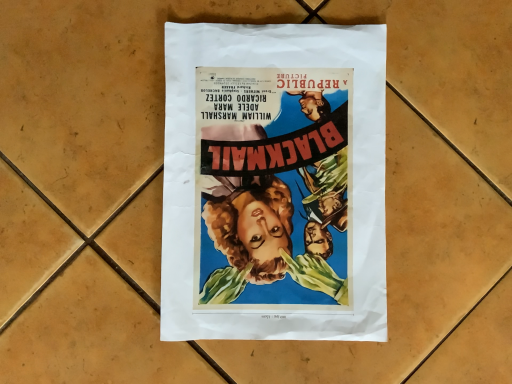
Measure the distance between point (161, 308) and camera.

A distance of 15.39 inches exists between point (161, 308) and camera.

What do you see at coordinates (274, 182) in the screenshot?
I see `vibrant paper poster at center` at bounding box center [274, 182].

I want to click on vibrant paper poster at center, so 274,182.

Find the location of `vibrant paper poster at center`. vibrant paper poster at center is located at coordinates (274, 182).